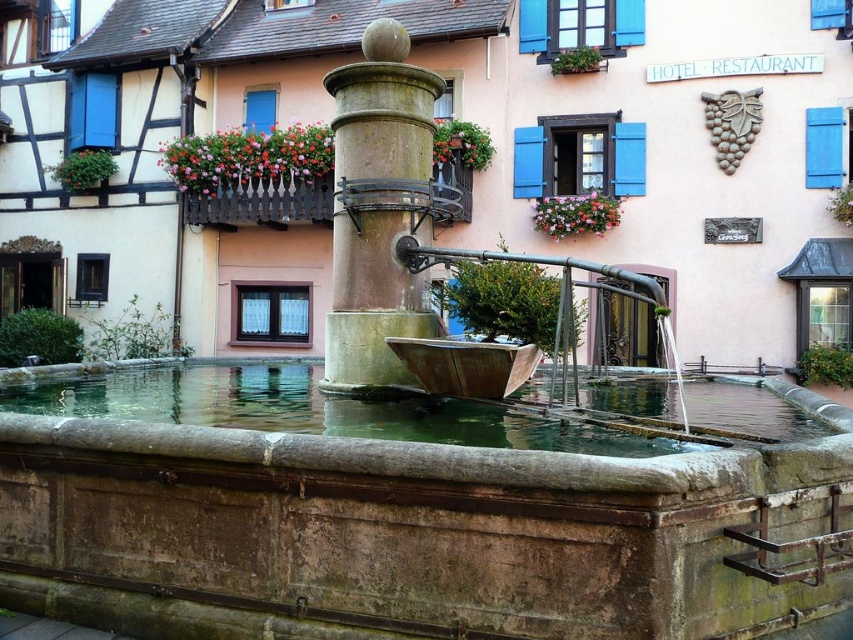
Does point (125, 592) come behind point (355, 355)?

That is False.

Which is more to the right, brown stone water at center or greenish stone fountain at center?

From the viewer's perspective, brown stone water at center appears more on the right side.

Describe the element at coordinates (415, 532) in the screenshot. I see `brown stone water at center` at that location.

Find the location of `brown stone water at center`. brown stone water at center is located at coordinates (415, 532).

Is green stone water at center positioned in front of greenish stone fountain at center?

Yes, green stone water at center is closer to the viewer.

Is point (281, 413) farther from viewer compared to point (387, 262)?

No, it is not.

Is point (154, 416) less distant than point (422, 124)?

Yes, it is.

This screenshot has width=853, height=640. Find the location of `green stone water at center`. green stone water at center is located at coordinates [x=305, y=408].

Can you confirm if brown stone water at center is smaller than green stone water at center?

Answer: Incorrect, brown stone water at center is not smaller in size than green stone water at center.

Which is below, brown stone water at center or green stone water at center?

Positioned lower is brown stone water at center.

Does point (608, 552) lie in front of point (212, 381)?

Yes, point (608, 552) is in front of point (212, 381).

The height and width of the screenshot is (640, 853). Find the location of `brown stone water at center`. brown stone water at center is located at coordinates (415, 532).